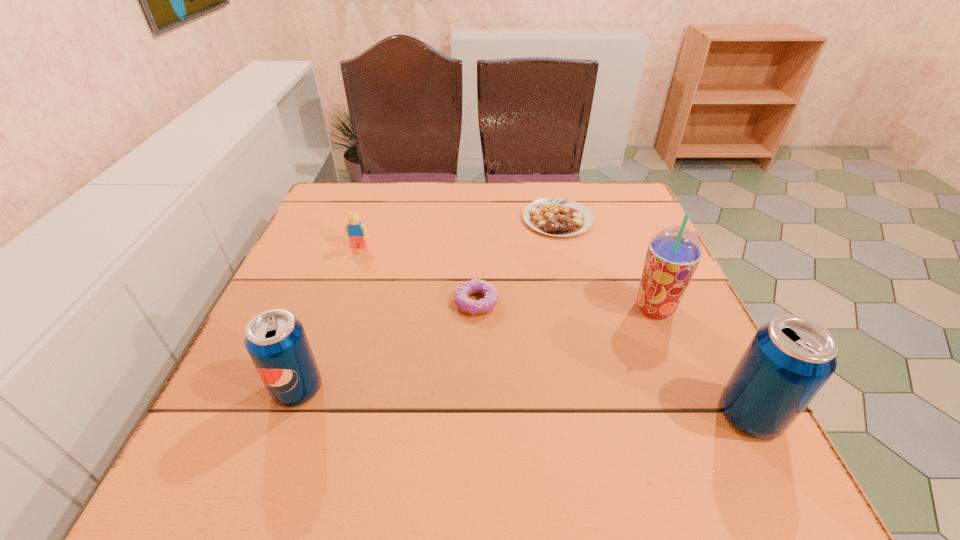
The height and width of the screenshot is (540, 960). I want to click on the left pop soda, so click(276, 341).

Identify the location of the shorter pop soda. The height and width of the screenshot is (540, 960). (276, 341).

Locate an element on the screen. This screenshot has height=540, width=960. the taller pop soda is located at coordinates (788, 361).

This screenshot has width=960, height=540. In order to click on the right pop soda in this screenshot , I will do coord(788,361).

Find the location of a particular element. The width and height of the screenshot is (960, 540). the farthest object is located at coordinates (559, 217).

Image resolution: width=960 pixels, height=540 pixels. Identify the location of steak. (559, 217).

Locate an element on the screen. This screenshot has height=540, width=960. the third shortest object is located at coordinates (357, 232).

This screenshot has height=540, width=960. Find the location of `Lego`. Lego is located at coordinates (357, 232).

Locate an element on the screen. This screenshot has width=960, height=540. the tallest object is located at coordinates (673, 254).

Locate an element on the screen. Image resolution: width=960 pixels, height=540 pixels. doughnut is located at coordinates (475, 286).